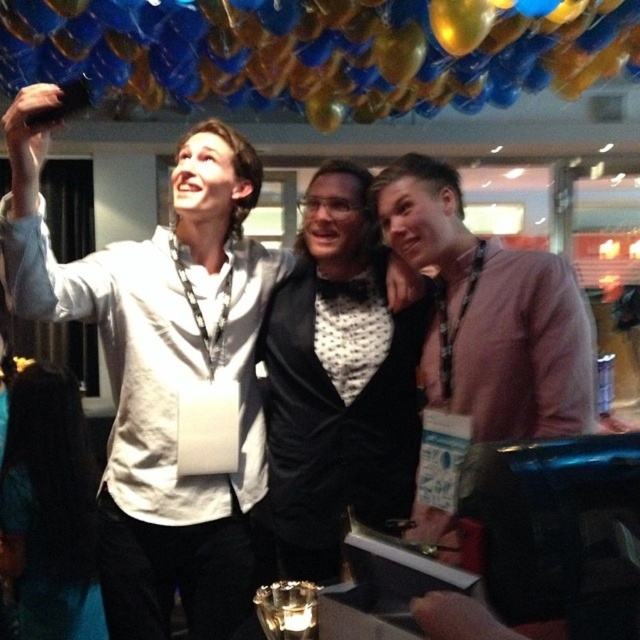
Which is more to the left, blue glossy balloon at upper center or pink fabric shirt at right?

blue glossy balloon at upper center

Is blue glossy balloon at upper center above pink fabric shirt at right?

Yes.

Does point (476, 68) come in front of point (547, 280)?

That is False.

Locate an element on the screen. This screenshot has height=640, width=640. blue glossy balloon at upper center is located at coordinates (321, 51).

Can you confirm if white matte shirt at upper left is positioned below blue glossy balloon at upper center?

Indeed, white matte shirt at upper left is positioned under blue glossy balloon at upper center.

Is point (26, 301) farther from viewer compared to point (488, 29)?

No, (26, 301) is in front of (488, 29).

Which is behind, point (145, 349) or point (296, 99)?

Positioned behind is point (296, 99).

Where is `white matte shirt at upper left`? Image resolution: width=640 pixels, height=640 pixels. white matte shirt at upper left is located at coordinates (161, 371).

Does point (212, 513) come in front of point (490, 269)?

No.

What do you see at coordinates (161, 371) in the screenshot? The height and width of the screenshot is (640, 640). I see `white matte shirt at upper left` at bounding box center [161, 371].

The width and height of the screenshot is (640, 640). Describe the element at coordinates (161, 371) in the screenshot. I see `white matte shirt at upper left` at that location.

You are a GUI agent. You are given a task and a screenshot of the screen. Output one action in this format:
    pyautogui.click(x=<x>, y=<y>)
    Task: Click on the white matte shirt at upper left
    
    Given the screenshot: What is the action you would take?
    pyautogui.click(x=161, y=371)